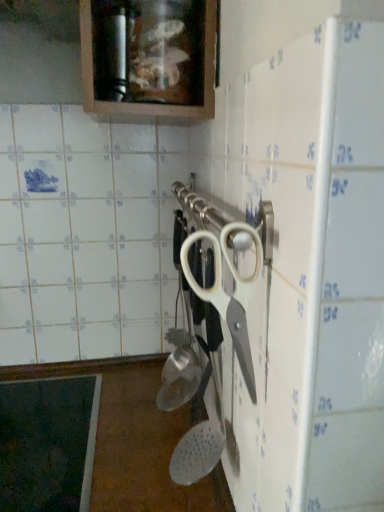
Question: Based on their sizes in the image, would you say matte wood cabinet at upper center is bigger or smaller than white plastic scissors at center?

Choices:
 (A) small
 (B) big

Answer: (B)

Question: In terms of width, does matte wood cabinet at upper center look wider or thinner when compared to white plastic scissors at center?

Choices:
 (A) wide
 (B) thin

Answer: (A)

Question: Is matte wood cabinet at upper center in front of or behind white plastic scissors at center in the image?

Choices:
 (A) behind
 (B) front

Answer: (A)

Question: Based on their positions, is white plastic scissors at center located to the left or right of matte wood cabinet at upper center?

Choices:
 (A) left
 (B) right

Answer: (B)

Question: Is white plastic scissors at center wider or thinner than matte wood cabinet at upper center?

Choices:
 (A) wide
 (B) thin

Answer: (B)

Question: In terms of size, does white plastic scissors at center appear bigger or smaller than matte wood cabinet at upper center?

Choices:
 (A) small
 (B) big

Answer: (A)

Question: In the image, is white plastic scissors at center positioned in front of or behind matte wood cabinet at upper center?

Choices:
 (A) behind
 (B) front

Answer: (B)